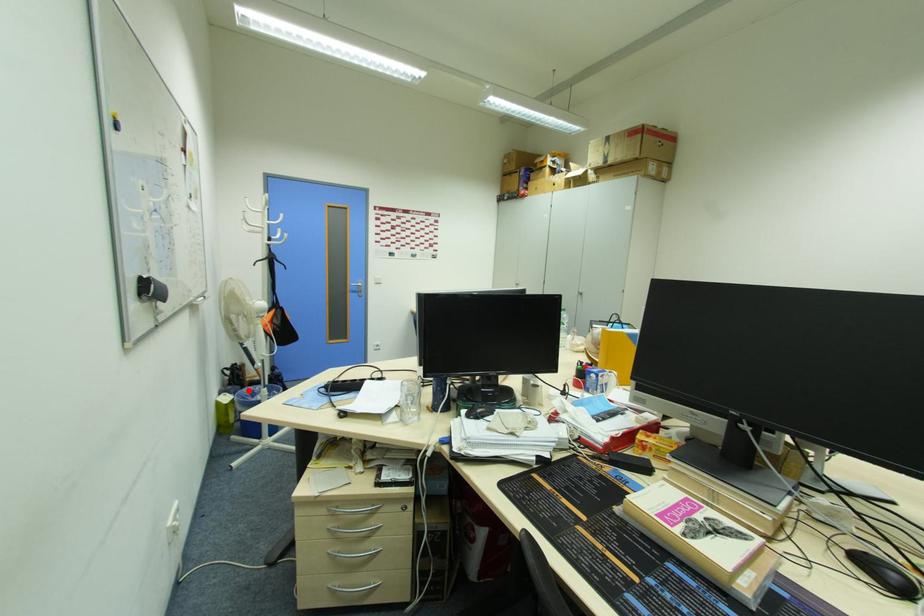
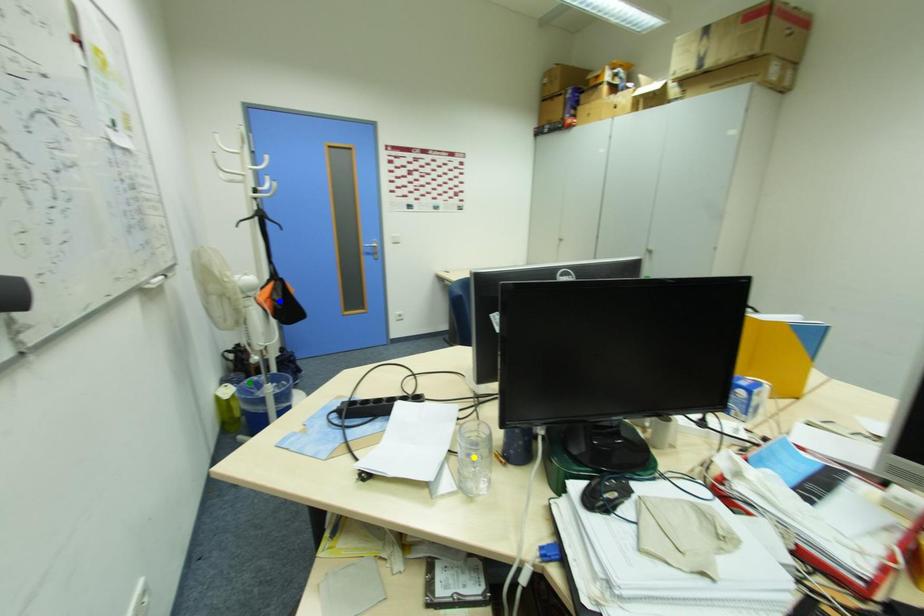
Question: I am providing you with two images of the same scene from different viewpoints. A red point is marked on the first image. You are given multiple points on the second image. Which point in image 2 is actually the same real-world point as the red point in image 1?

Choices:
 (A) yellow point
 (B) blue point
 (C) green point

Answer: (C)